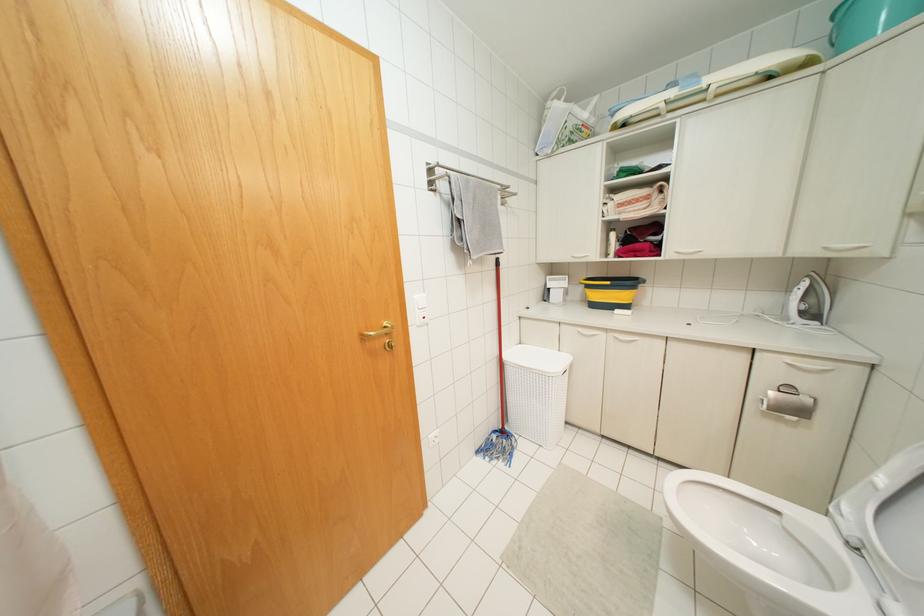
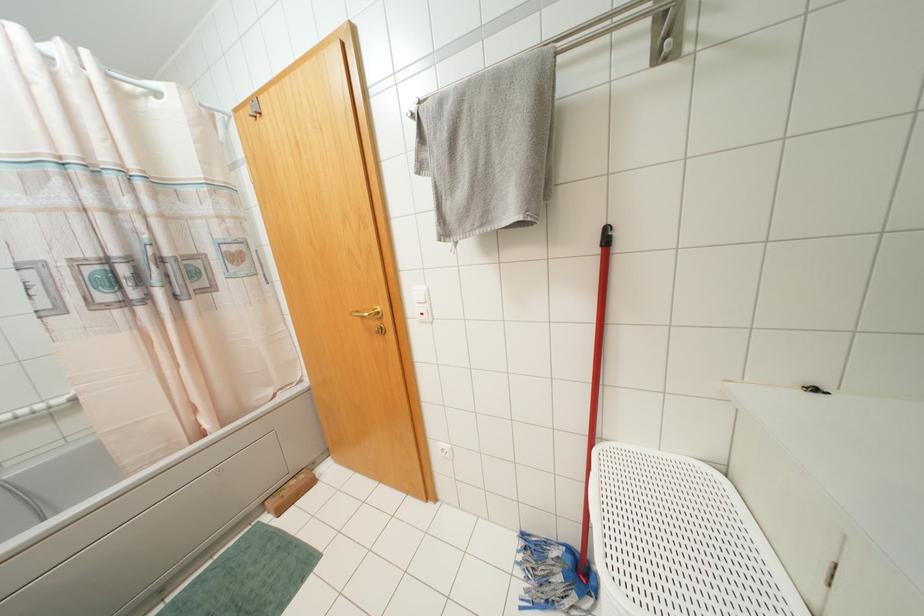
Where in the second image is the point corresponding to (496,259) from the first image?

(606, 229)